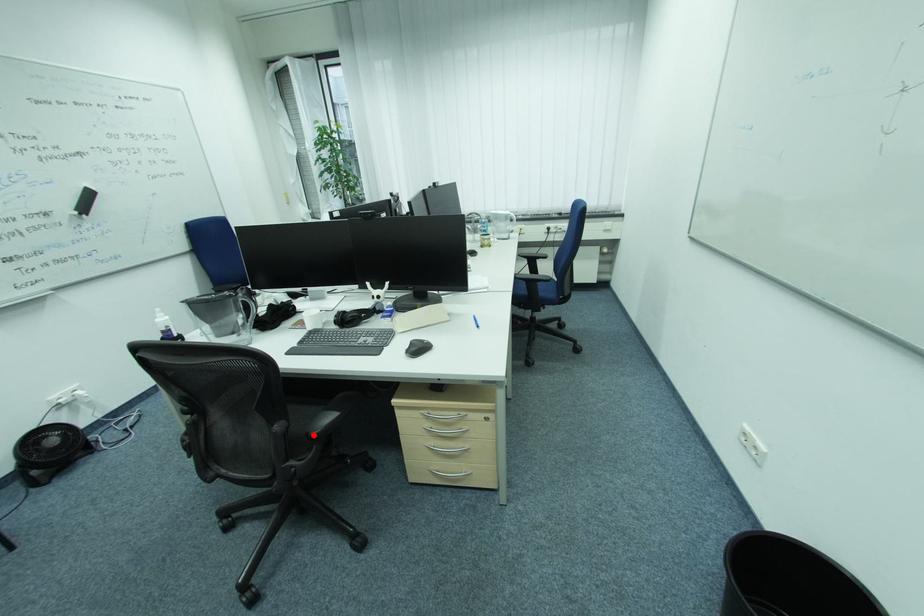
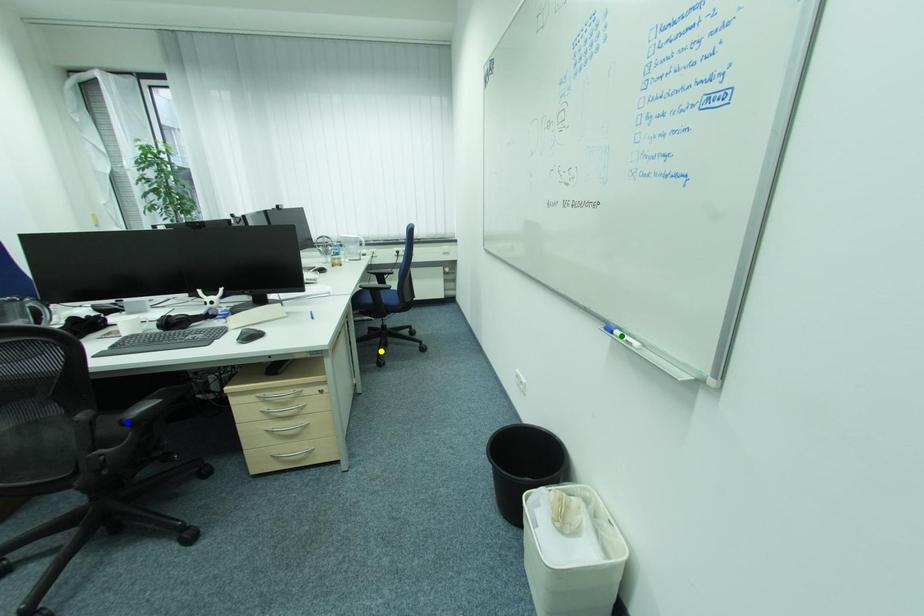
Question: I am providing you with two images of the same scene from different viewpoints. A red point is marked on the first image. You are given multiple points on the second image. Which mark in image 2 goes with the point in image 1?

Choices:
 (A) blue point
 (B) yellow point
 (C) green point

Answer: (A)